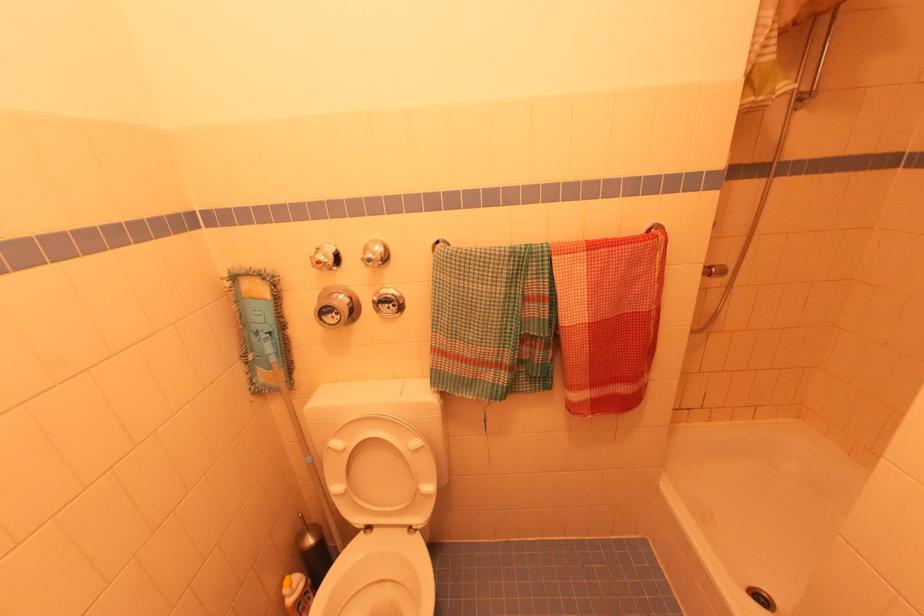
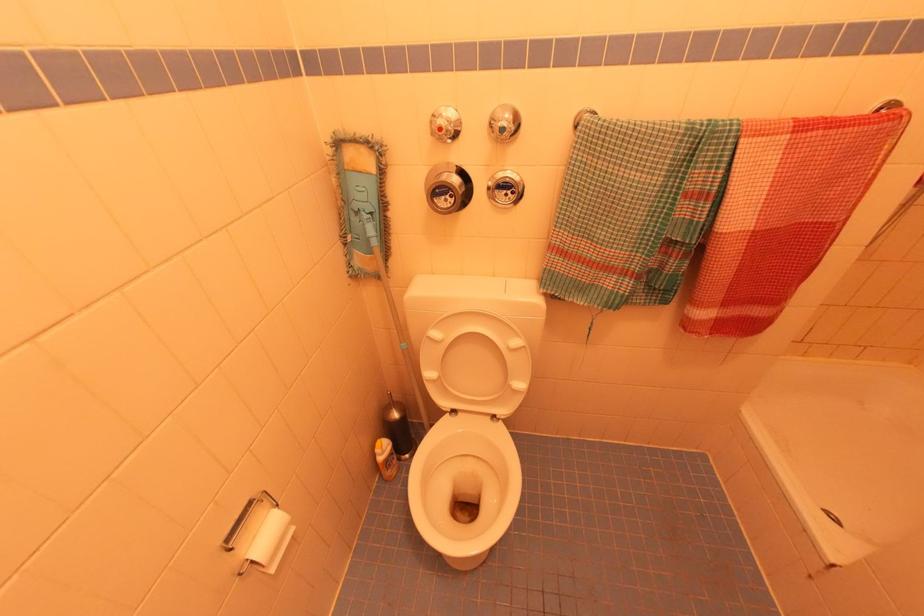
Find the pixel in the second image that matches point 332,315 in the first image.

(444, 198)